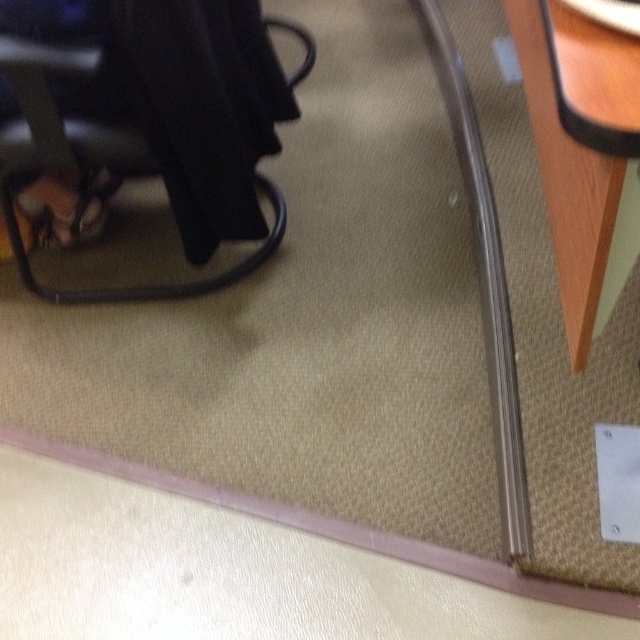
You are standing at the center of the beige carpeted floor. You need to place a small potted plant exactly at point (582, 154). Will the plant be placed on the wooden table at lower right?

Yes, the point (582, 154) is on the wooden table at lower right, so placing the plant there will put it on the wooden table at lower right.

In the scene shown: You are standing on the beige carpeted floor and see the wooden table at lower right and the brown leather sandal at lower left. Which object is higher up from the floor?

The wooden table at lower right is taller than the brown leather sandal at lower left, so it is higher up from the floor.

You are standing in an office and see the wooden table at lower right and the brown leather sandal at lower left. Which object is closer to you?

The wooden table at lower right is closer to you because it is positioned over the brown leather sandal at lower left, indicating it is in front of it.